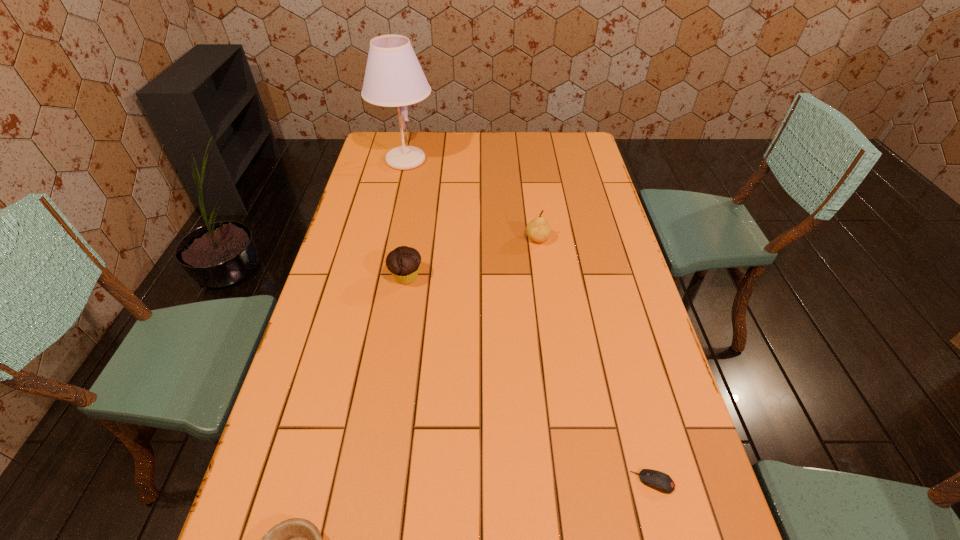
Where is `the farthest object`? Image resolution: width=960 pixels, height=540 pixels. the farthest object is located at coordinates (393, 77).

The width and height of the screenshot is (960, 540). I want to click on the tallest object, so click(x=393, y=77).

Locate an element on the screen. This screenshot has width=960, height=540. the second object from right to left is located at coordinates (538, 230).

Find the location of a particular element. pear is located at coordinates (x=538, y=230).

The height and width of the screenshot is (540, 960). I want to click on the third nearest object, so click(403, 262).

Locate an element on the screen. This screenshot has height=540, width=960. the second nearest object is located at coordinates (657, 480).

Find the location of `the shortest object`. the shortest object is located at coordinates (657, 480).

In order to click on free space located 0.130m on the right of the lampshade in this screenshot , I will do `click(468, 160)`.

At what (x,y) coordinates should I click in order to perform the action: click on free location located on the front of the second farthest object. Please return your answer as a coordinate pair (x, y). Image resolution: width=960 pixels, height=540 pixels. Looking at the image, I should click on (550, 332).

Where is `free location located on the front of the third nearest object`? The image size is (960, 540). free location located on the front of the third nearest object is located at coordinates (398, 325).